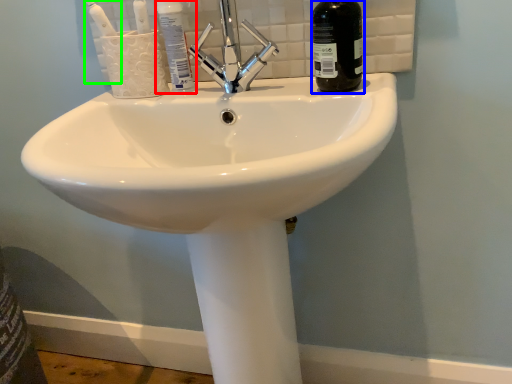
Question: Estimate the real-world distances between objects in this image. Which object is farther from mouthwash (highlighted by a red box), bottle (highlighted by a blue box) or toothbrush (highlighted by a green box)?

Choices:
 (A) bottle
 (B) toothbrush

Answer: (A)